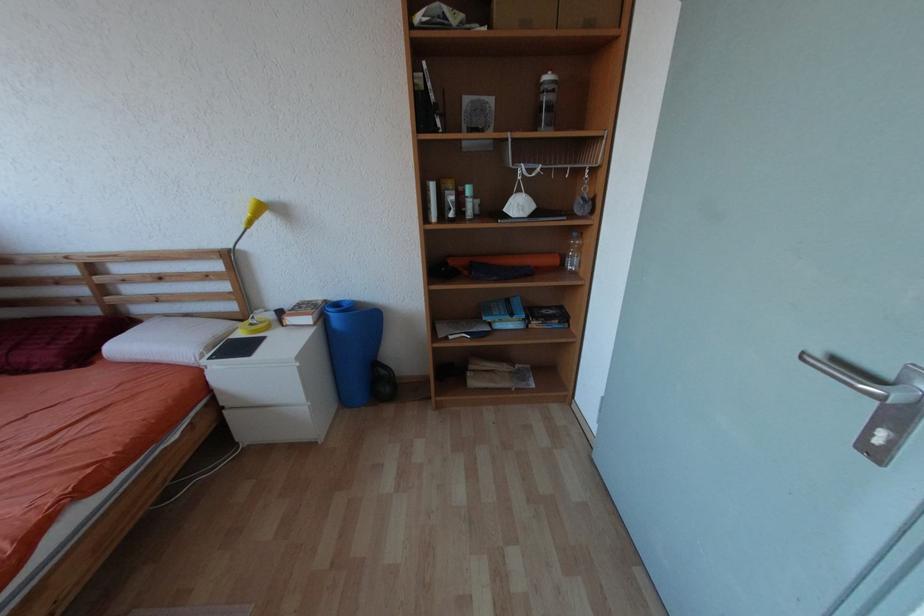
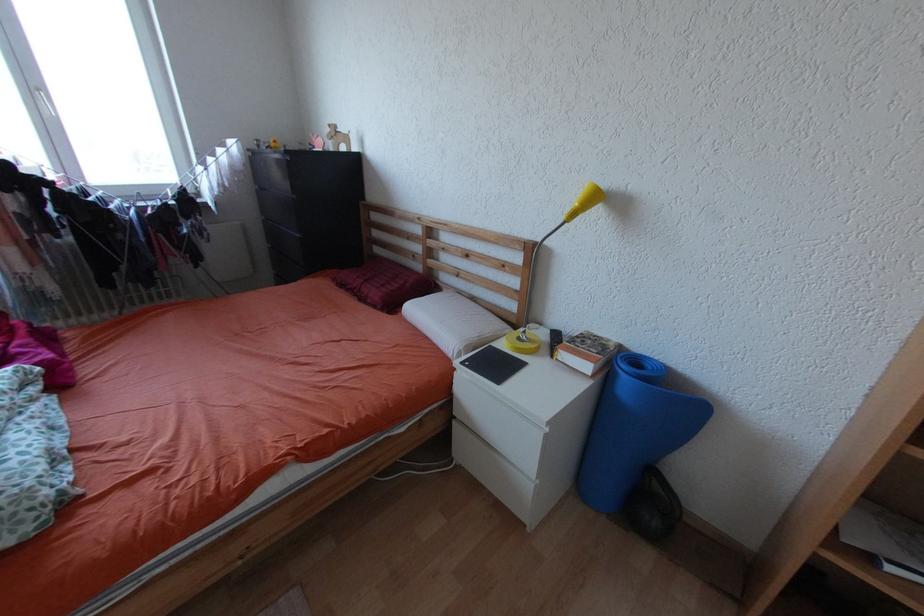
Question: The images are taken continuously from a first-person perspective. In which direction is your viewpoint rotating?

Choices:
 (A) Left
 (B) Right
 (C) Up
 (D) Down

Answer: (A)